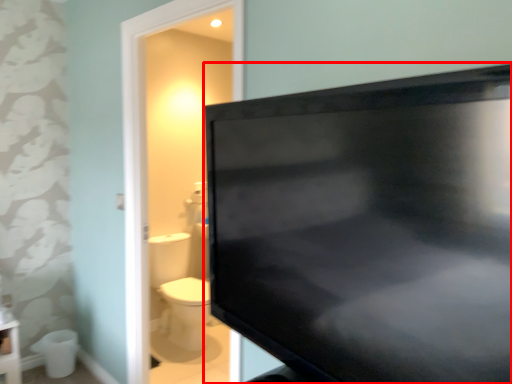
Question: From the image, what is the correct spatial relationship of television (annotated by the red box) in relation to toilet bowl?

Choices:
 (A) left
 (B) right

Answer: (B)